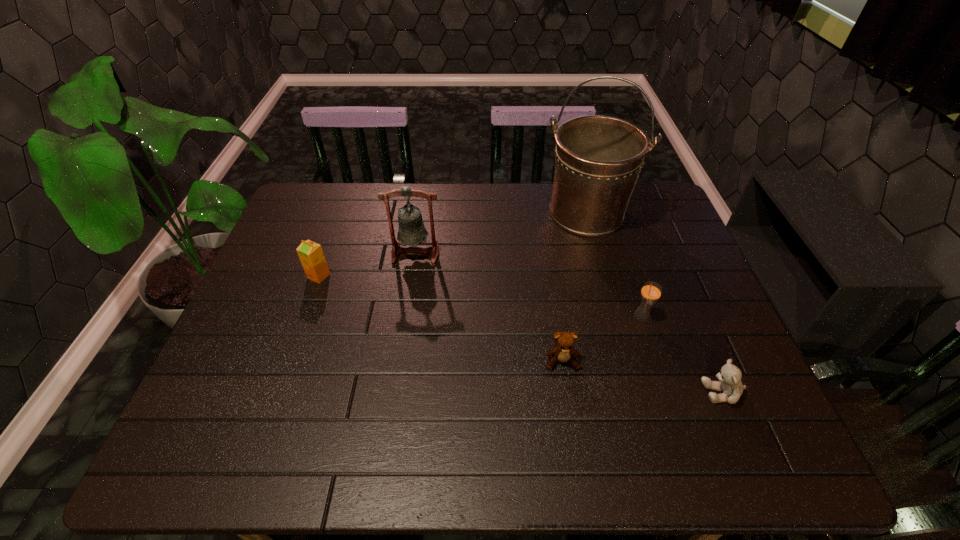
The image size is (960, 540). I want to click on empty space that is in between the fifth nearest object and the rightmost object, so click(x=569, y=322).

Where is `free point between the left teddy bear and the right teddy bear`? This screenshot has height=540, width=960. free point between the left teddy bear and the right teddy bear is located at coordinates (642, 376).

Locate an element on the screen. The width and height of the screenshot is (960, 540). free space between the third farthest object and the farther teddy bear is located at coordinates (441, 319).

This screenshot has width=960, height=540. I want to click on free area in between the third shortest object and the bell, so click(368, 265).

You are a GUI agent. You are given a task and a screenshot of the screen. Output one action in this format:
    pyautogui.click(x=<x>, y=<y>)
    Task: Click on the vacant space that is in between the fourth farthest object and the fifth farthest object
    The height and width of the screenshot is (540, 960).
    Given the screenshot: What is the action you would take?
    pyautogui.click(x=602, y=338)

Identify the location of free space that is in between the bucket and the fifth farthest object. (574, 287).

Where is `free space between the left teddy bear and the bucket`? The width and height of the screenshot is (960, 540). free space between the left teddy bear and the bucket is located at coordinates (574, 287).

This screenshot has width=960, height=540. Identify the location of free area in between the fifth object from right to left and the third farthest object. (368, 265).

Identify the location of free space between the second farthest object and the farthest object. The height and width of the screenshot is (540, 960). (501, 233).

Identify the location of the second closest object relative to the third farthest object. (564, 349).